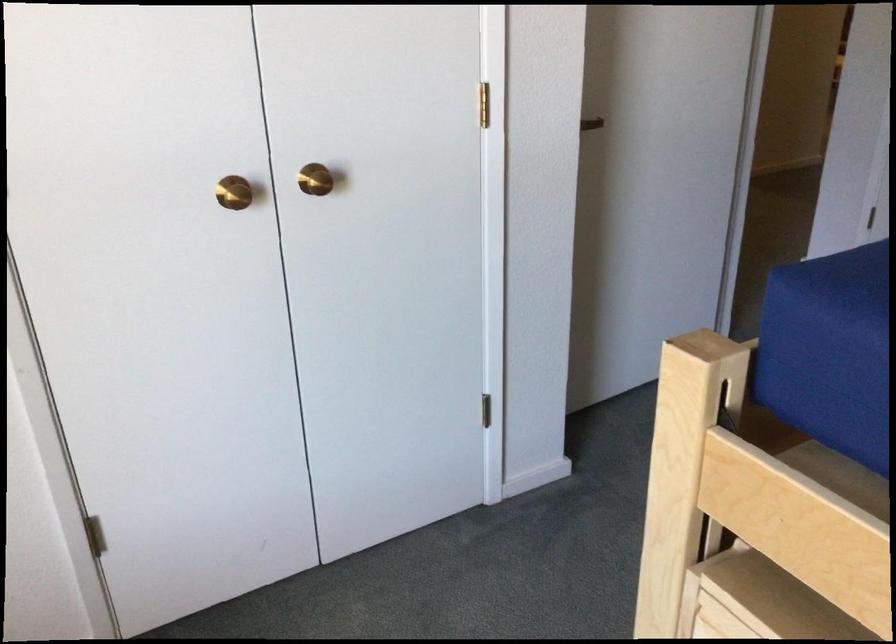
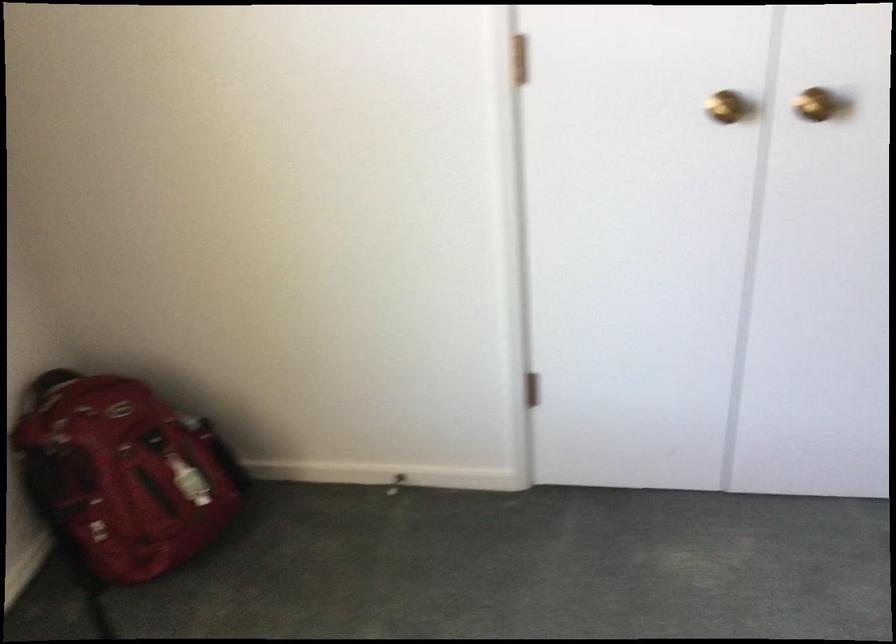
Question: How did the camera likely rotate?

Choices:
 (A) Left
 (B) Right
 (C) Up
 (D) Down

Answer: (A)